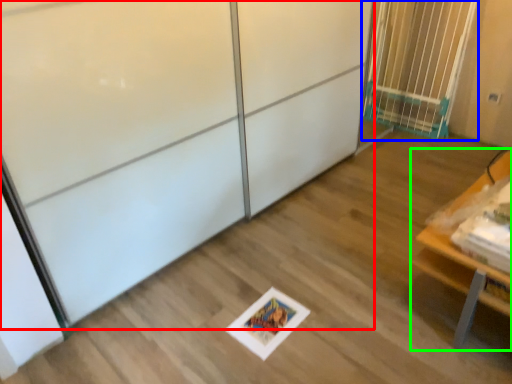
Question: Estimate the real-world distances between objects in this image. Which object is farther from screen door (highlighted by a red box), elevator (highlighted by a blue box) or furniture (highlighted by a green box)?

Choices:
 (A) elevator
 (B) furniture

Answer: (A)